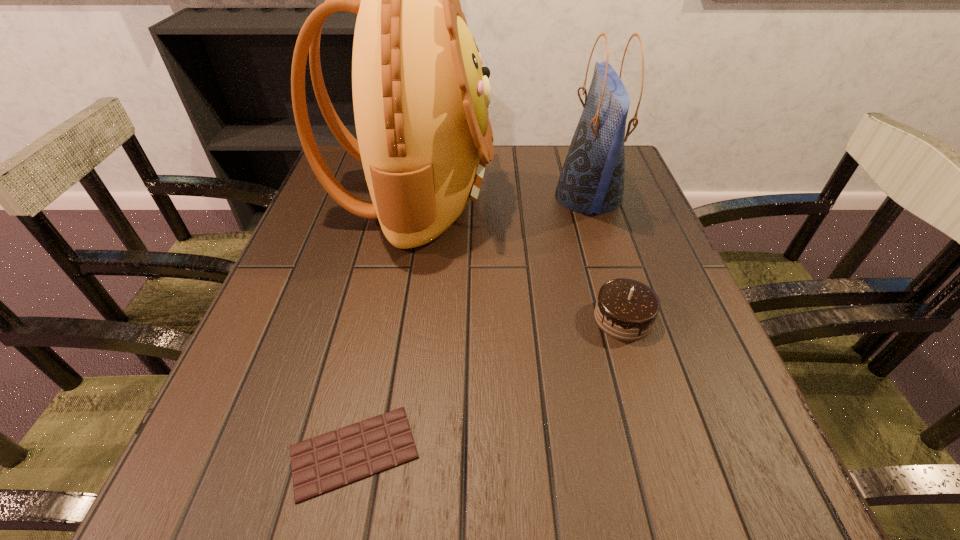
Locate an element on the screen. free space between the shortest object and the second tallest object is located at coordinates (471, 325).

What are the coordinates of `blank region between the chocolate cake and the chocolate bar` in the screenshot? It's located at (489, 385).

You are a GUI agent. You are given a task and a screenshot of the screen. Output one action in this format:
    pyautogui.click(x=<x>, y=<y>)
    Task: Click on the unoccupied area between the tallest object and the shopping bag
    The image size is (960, 540).
    Given the screenshot: What is the action you would take?
    pyautogui.click(x=501, y=197)

Identify the location of free space between the third farthest object and the backpack. (518, 258).

Select which object is the second closest to the second tallest object. Please provide its 2D coordinates. Your answer should be formatted as a tuple, i.e. [(x, y)], where the tuple contains the x and y coordinates of a point satisfying the conditions above.

[(626, 309)]

Point out which object is positioned as the nearest to the second shortest object. Please provide its 2D coordinates. Your answer should be formatted as a tuple, i.e. [(x, y)], where the tuple contains the x and y coordinates of a point satisfying the conditions above.

[(420, 94)]

Image resolution: width=960 pixels, height=540 pixels. Identify the location of vacant area in the image that satisfies the following two spatial constraints: 1. on the front-facing side of the tallest object; 2. on the back side of the third farthest object. (390, 318).

The width and height of the screenshot is (960, 540). I want to click on blank space that satisfies the following two spatial constraints: 1. on the back side of the shopping bag; 2. on the right side of the third tallest object, so click(586, 197).